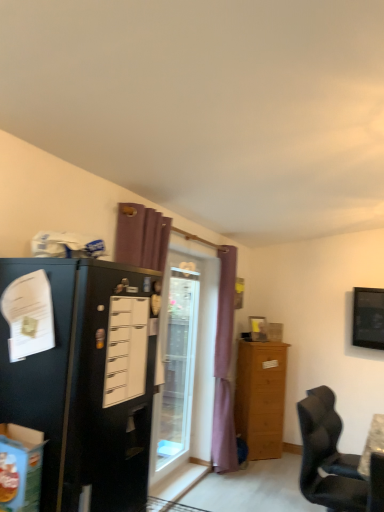
Question: Is the depth of light brown wooden cabinet at right less than that of black matte refrigerator at left?

Choices:
 (A) yes
 (B) no

Answer: (B)

Question: Can you confirm if light brown wooden cabinet at right is wider than black matte refrigerator at left?

Choices:
 (A) yes
 (B) no

Answer: (B)

Question: Can you confirm if light brown wooden cabinet at right is smaller than black matte refrigerator at left?

Choices:
 (A) no
 (B) yes

Answer: (B)

Question: Does light brown wooden cabinet at right have a lesser width compared to black matte refrigerator at left?

Choices:
 (A) no
 (B) yes

Answer: (B)

Question: From the image's perspective, is light brown wooden cabinet at right over black matte refrigerator at left?

Choices:
 (A) yes
 (B) no

Answer: (B)

Question: In the image, is black matte refrigerator at left positioned in front of or behind purple fabric curtain at center?

Choices:
 (A) behind
 (B) front

Answer: (B)

Question: Do you think black matte refrigerator at left is within purple fabric curtain at center, or outside of it?

Choices:
 (A) inside
 (B) outside

Answer: (B)

Question: Based on their positions, is black matte refrigerator at left located to the left or right of purple fabric curtain at center?

Choices:
 (A) right
 (B) left

Answer: (B)

Question: From their relative heights in the image, would you say black matte refrigerator at left is taller or shorter than purple fabric curtain at center?

Choices:
 (A) tall
 (B) short

Answer: (B)

Question: From the image's perspective, is wooden picture frame at upper center located above or below black leather chair at lower right?

Choices:
 (A) below
 (B) above

Answer: (B)

Question: Would you say wooden picture frame at upper center is inside or outside black leather chair at lower right?

Choices:
 (A) outside
 (B) inside

Answer: (A)

Question: Is wooden picture frame at upper center in front of or behind black leather chair at lower right in the image?

Choices:
 (A) front
 (B) behind

Answer: (B)

Question: In terms of height, does wooden picture frame at upper center look taller or shorter compared to black leather chair at lower right?

Choices:
 (A) tall
 (B) short

Answer: (B)

Question: In terms of height, does black glossy tv at upper right look taller or shorter compared to black matte refrigerator at left?

Choices:
 (A) tall
 (B) short

Answer: (B)

Question: From the image's perspective, is black glossy tv at upper right above or below black matte refrigerator at left?

Choices:
 (A) above
 (B) below

Answer: (B)